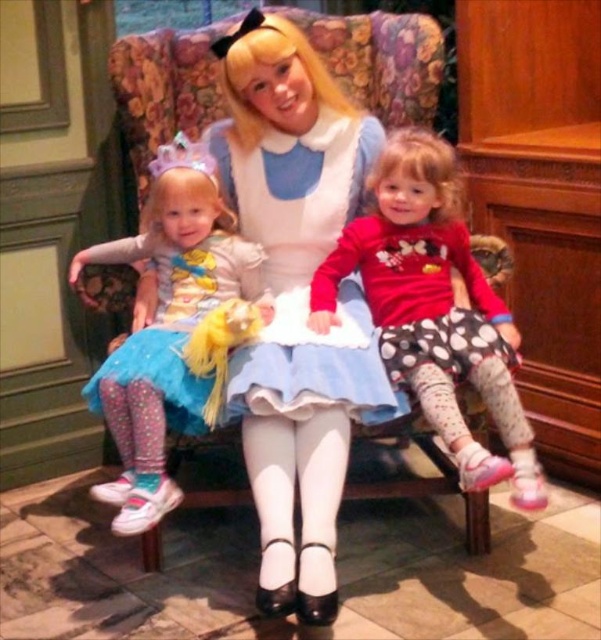
Question: Can you confirm if polka dot skirt at center is wider than matte blue dress at center?

Choices:
 (A) yes
 (B) no

Answer: (A)

Question: Which point appears closest to the camera in this image?

Choices:
 (A) (397, 349)
 (B) (120, 76)

Answer: (A)

Question: Which object is the farthest from the polka dot skirt at center?

Choices:
 (A) floral fabric armchair at center
 (B) matte white dress at center

Answer: (A)

Question: Which is nearer to the polka dot skirt at center?

Choices:
 (A) floral fabric armchair at center
 (B) polka dot leggings at left

Answer: (A)

Question: Can you confirm if floral fabric armchair at center is bigger than polka dot skirt at center?

Choices:
 (A) no
 (B) yes

Answer: (A)

Question: Does polka dot skirt at center appear on the left side of matte white dress at center?

Choices:
 (A) no
 (B) yes

Answer: (A)